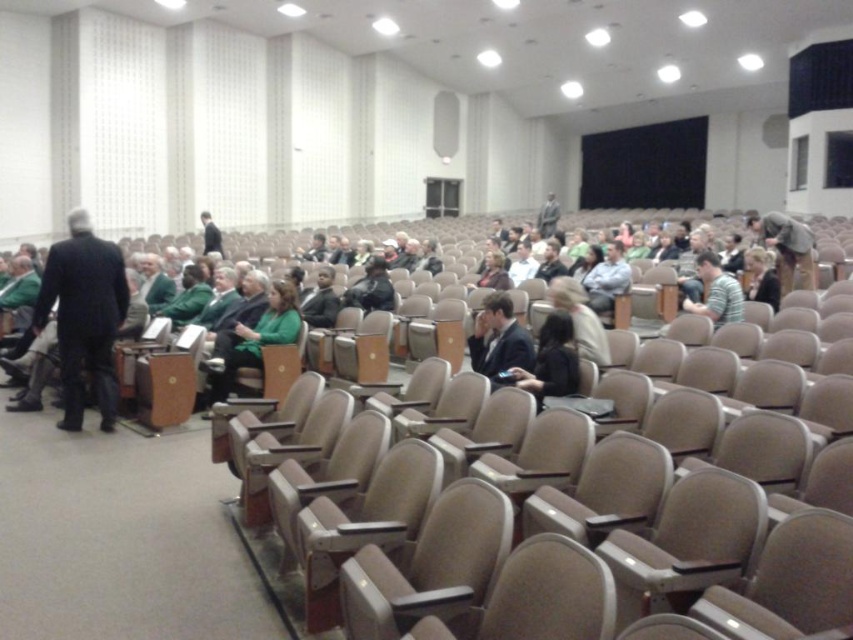
Question: Which point appears closest to the camera in this image?

Choices:
 (A) (753, 225)
 (B) (73, 420)
 (C) (506, 339)
 (D) (589, 296)

Answer: (C)

Question: Can you confirm if dark suit at center is thinner than brown leather jacket at center?

Choices:
 (A) no
 (B) yes

Answer: (B)

Question: Among these objects, which one is nearest to the camera?

Choices:
 (A) striped cotton shirt at center
 (B) matte gray shirt at center
 (C) dark suit at center

Answer: (C)

Question: Which object is the closest to the dark suit at left?

Choices:
 (A) brown leather jacket at center
 (B) matte gray shirt at center
 (C) dark suit at center
 (D) striped cotton shirt at center

Answer: (C)

Question: Can you confirm if striped cotton shirt at center is thinner than matte gray shirt at center?

Choices:
 (A) yes
 (B) no

Answer: (A)

Question: Is brown leather jacket at center to the right of matte gray shirt at center from the viewer's perspective?

Choices:
 (A) yes
 (B) no

Answer: (A)